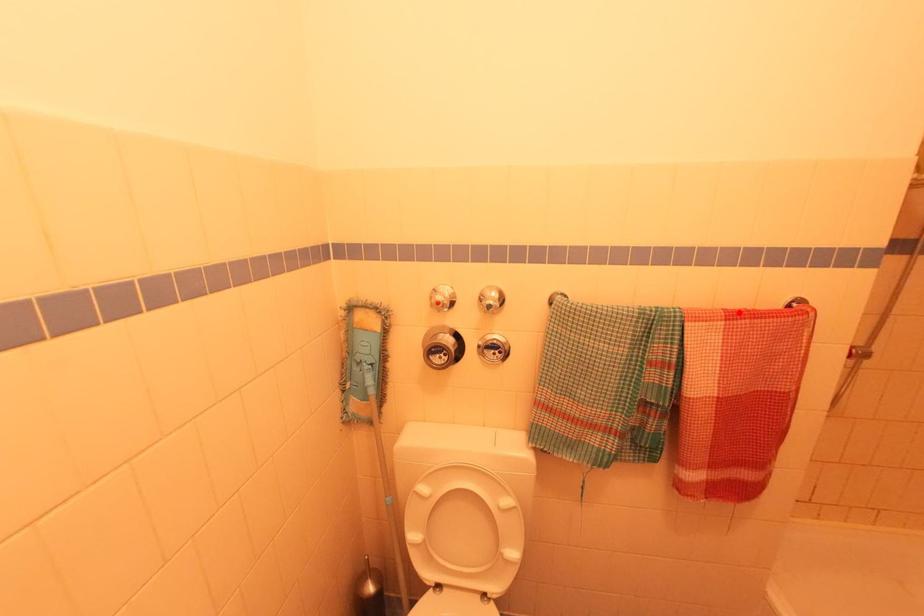
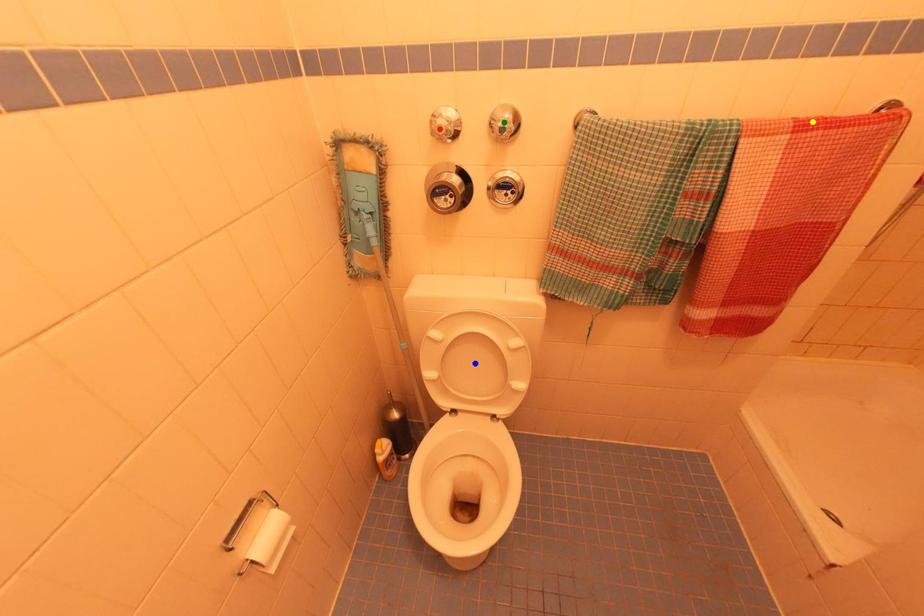
Question: I am providing you with two images of the same scene from different viewpoints. A red point is marked on the first image. You are given multiple points on the second image. Which mark in image 2 goes with the point in image 1?

Choices:
 (A) yellow point
 (B) green point
 (C) blue point

Answer: (A)